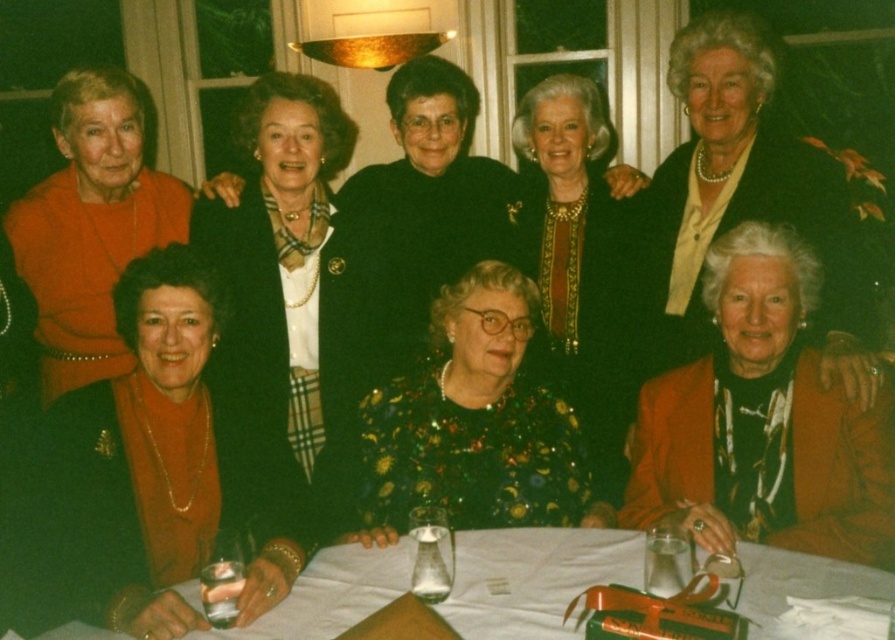
Is matte orange jacket at lower right taller than white cloth at lower center?

Yes, matte orange jacket at lower right is taller than white cloth at lower center.

Does matte orange jacket at lower right lie behind white cloth at lower center?

Yes, it is.

Is point (748, 461) in front of point (551, 609)?

No, (748, 461) is behind (551, 609).

Locate an element on the screen. Image resolution: width=895 pixels, height=640 pixels. matte orange jacket at lower right is located at coordinates (763, 422).

Which is above, matte black blazer at center or white cloth at lower center?

Positioned higher is matte black blazer at center.

Does matte black blazer at center come in front of white cloth at lower center?

That is False.

Does point (333, 492) come closer to viewer compared to point (776, 579)?

No.

Image resolution: width=895 pixels, height=640 pixels. In order to click on matte black blazer at center in this screenshot , I will do `click(303, 298)`.

Is matte black jacket at lower right taller than matte orange dress at lower left?

Yes.

Is point (820, 348) positioned after point (99, 168)?

That is False.

Where is `matte black jacket at lower right`? Image resolution: width=895 pixels, height=640 pixels. matte black jacket at lower right is located at coordinates (751, 193).

Find the location of a particular element. matte black jacket at lower right is located at coordinates (751, 193).